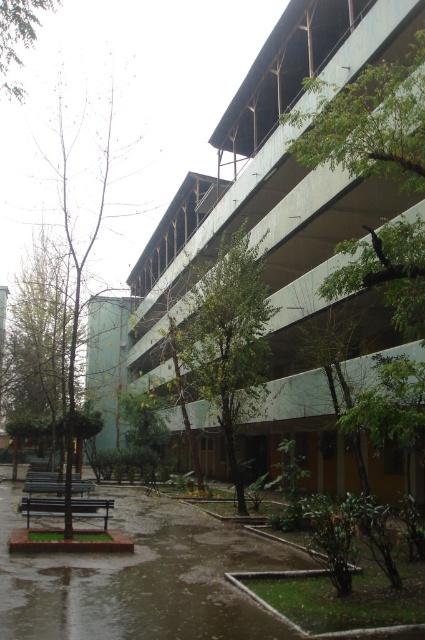
You are standing at the point marked as point [37,348] in the image. Looking around, you see a green leafy tree at left. Which direction should you face to see the green leafy tree at left?

You should face towards the left direction to see the green leafy tree at left since you are standing at point [37,348] which corresponds to that location.

You are planning to plant a new tree in the area between the green leafy tree at upper center and the bare wood tree at left. Considering their current sizes, which tree would allow more space for the new tree?

The green leafy tree at upper center occupies less space than the bare wood tree at left, so planting the new tree near the green leafy tree at upper center would provide more available space.

You are standing at the point marked as point (x=370, y=122) in the image. Looking around, you see a green leafy tree at upper center. Which direction should you face to look towards the multi story building with wooden beam supported balconies?

The green leafy tree at upper center is located at point (x=370, y=122). Since the multi story building with wooden beam supported balconies is part of the scene described in the scene context, you should face away from the tree towards the building. However, based on the coordinate provided and the scene description, the building is likely positioned opposite to the tree at that point, so facing away from the tree towards the building would be the correct direction.